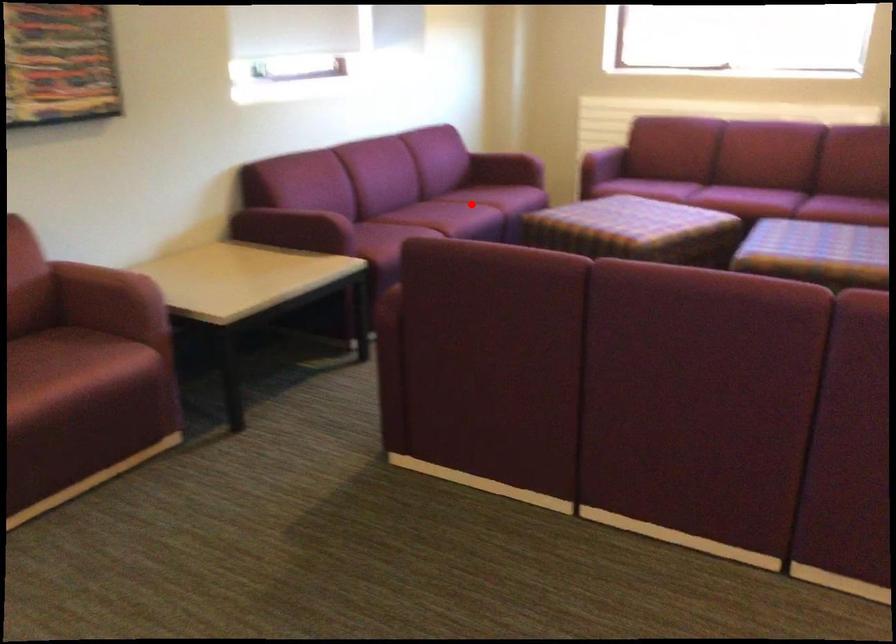
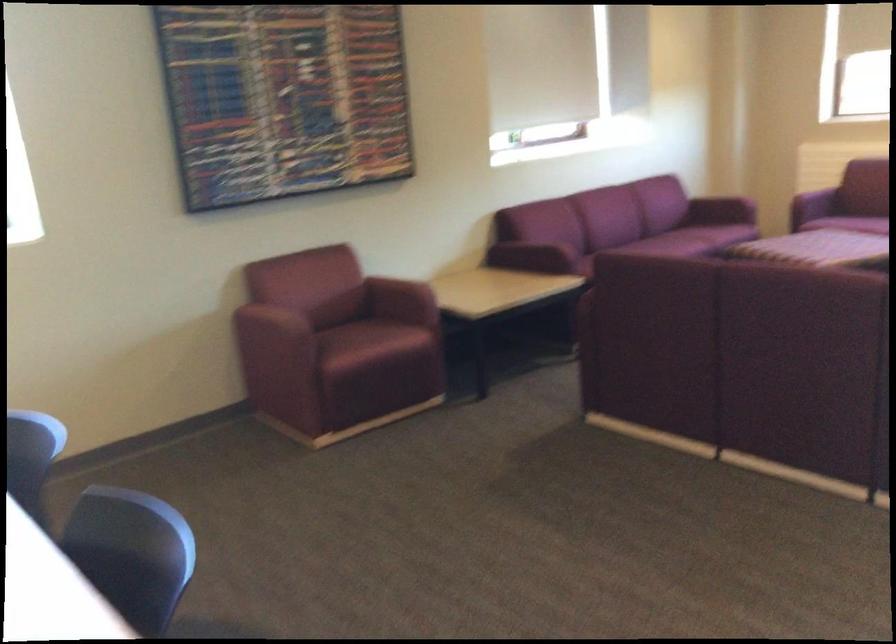
In the second image, find the point that corresponds to the highlighted location in the first image.

(683, 242)